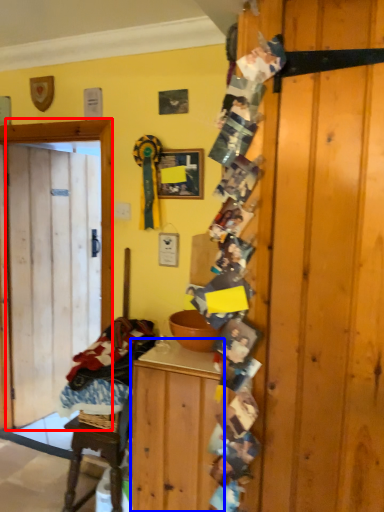
Question: Which object appears closest to the camera in this image, door (highlighted by a red box) or cabinetry (highlighted by a blue box)?

Choices:
 (A) door
 (B) cabinetry

Answer: (B)